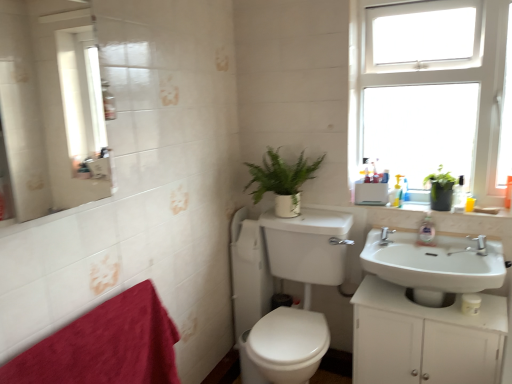
What do you see at coordinates (426, 231) in the screenshot?
I see `clear plastic soap dispenser at sink right` at bounding box center [426, 231].

Image resolution: width=512 pixels, height=384 pixels. I want to click on yellow plastic bottle at upper right, placed as the second toiletry when sorted from back to front, so click(469, 204).

This screenshot has width=512, height=384. Find the location of `white plastic window at upper right`. white plastic window at upper right is located at coordinates (438, 74).

Measure the distance between point (393, 192) and camera.

The depth of point (393, 192) is 2.13 meters.

In order to click on metallic reflective mirror at upper left in this screenshot , I will do click(51, 106).

From a real-world perspective, is yellow plastic bottle at upper right, placed as the second toiletry when sorted from back to front, positioned above or below white glossy sink at upper right?

yellow plastic bottle at upper right, placed as the second toiletry when sorted from back to front, is above white glossy sink at upper right.

Which of these two, yellow plastic bottle at upper right, the second toiletry positioned from the left, or white glossy sink at upper right, is wider?

white glossy sink at upper right.

Measure the distance between yellow plastic bottle at upper right, the second toiletry positioned from the left, and white glossy sink at upper right.

6.50 inches.

Does yellow plastic bottle at upper right, marked as the first toiletry in a front-to-back arrangement, turn towards white glossy sink at upper right?

No.

Are white matte cabinet at lower right and translucent plastic soap dispenser at upper right, which is the second toiletry in right-to-left order, making contact?

No, white matte cabinet at lower right is not touching translucent plastic soap dispenser at upper right, which is the second toiletry in right-to-left order.

Is white matte cabinet at lower right further to the viewer compared to translucent plastic soap dispenser at upper right, which ranks as the second toiletry in front-to-back order?

That is False.

This screenshot has height=384, width=512. Identify the location of toiletry on the left of white matte cabinet at lower right. (396, 193).

Who is smaller, white matte cabinet at lower right or translucent plastic soap dispenser at upper right, which is the second toiletry in right-to-left order?

With smaller size is translucent plastic soap dispenser at upper right, which is the second toiletry in right-to-left order.

From the image's perspective, which one is positioned lower, white plastic window at upper right or green matte plant at upper right?

From the image's view, green matte plant at upper right is below.

Would you say white plastic window at upper right contains green matte plant at upper right?

No, green matte plant at upper right is not surrounded by white plastic window at upper right.

Is white plastic window at upper right behind green matte plant at upper right?

No, white plastic window at upper right is closer to the viewer.

Identify the location of window in front of the green matte plant at upper right. (438, 74).

From a real-world perspective, which object stands above the other?

clear plastic soap dispenser at sink right.

Who is shorter, clear plastic soap dispenser at sink right or white matte toilet paper at lower center?

Standing shorter between the two is white matte toilet paper at lower center.

Considering the sizes of clear plastic soap dispenser at sink right and white matte toilet paper at lower center in the image, is clear plastic soap dispenser at sink right wider or thinner than white matte toilet paper at lower center?

Result: Considering their sizes, clear plastic soap dispenser at sink right looks slimmer than white matte toilet paper at lower center.

Looking at this image, is clear plastic soap dispenser at sink right inside or outside of white matte toilet paper at lower center?

The correct answer is: outside.

From the picture: Considering the relative sizes of translucent plastic soap dispenser at upper right, which is the second toiletry in right-to-left order, and white plastic window at upper right in the image provided, is translucent plastic soap dispenser at upper right, which is the second toiletry in right-to-left order, thinner than white plastic window at upper right?

Yes, translucent plastic soap dispenser at upper right, which is the second toiletry in right-to-left order, is thinner than white plastic window at upper right.

Looking at this image, from the image's perspective, is translucent plastic soap dispenser at upper right, which is the second toiletry in right-to-left order, located above white plastic window at upper right?

Actually, translucent plastic soap dispenser at upper right, which is the second toiletry in right-to-left order, appears below white plastic window at upper right in the image.

Considering the positions of objects translucent plastic soap dispenser at upper right, placed as the 1th toiletry when sorted from left to right, and white plastic window at upper right in the image provided, who is more to the left, translucent plastic soap dispenser at upper right, placed as the 1th toiletry when sorted from left to right, or white plastic window at upper right?

translucent plastic soap dispenser at upper right, placed as the 1th toiletry when sorted from left to right.

Considering the positions of point (394, 187) and point (354, 142), is point (394, 187) closer or farther from the camera than point (354, 142)?

Point (394, 187).

Are white glossy sink at upper right and white matte toilet paper at lower center located far from each other?

No, white glossy sink at upper right is not far from white matte toilet paper at lower center.

From the image's perspective, is white glossy sink at upper right beneath white matte toilet paper at lower center?

Incorrect, from the image's perspective, white glossy sink at upper right is higher than white matte toilet paper at lower center.

From a real-world perspective, is white glossy sink at upper right beneath white matte toilet paper at lower center?

No, from a real-world perspective, white glossy sink at upper right is not under white matte toilet paper at lower center.

What's the angular difference between white glossy sink at upper right and white matte toilet paper at lower center's facing directions?

There is a 0.235-degree angle between the facing directions of white glossy sink at upper right and white matte toilet paper at lower center.

Is green matte plant at center in front of white glossy sink at lower right, the second sink when ordered from left to right?

That is False.

Is green matte plant at center oriented towards white glossy sink at lower right, marked as the 1th sink in a right-to-left arrangement?

No, green matte plant at center is not aimed at white glossy sink at lower right, marked as the 1th sink in a right-to-left arrangement.

From a real-world perspective, which object stands above the other?

green matte plant at center, from a real-world perspective.

Which toiletry is the 1st one when counting from the back of the white glossy sink at upper right? Please provide its 2D coordinates.

[(469, 204)]

Locate an element on the screen. The image size is (512, 384). toiletry on the left of white matte cabinet at lower right is located at coordinates (396, 193).

When comparing their distances from metallic reflective mirror at upper left, does white glossy sink at lower right, marked as the 1th sink in a right-to-left arrangement, or white matte cabinet at lower right seem further?

The object further to metallic reflective mirror at upper left is white matte cabinet at lower right.

From the image, which object appears to be nearer to velvety red bath towel at lower left, yellow plastic bottle at upper right, marked as the first toiletry in a front-to-back arrangement, or translucent plastic soap dispenser at upper right, which ranks as the second toiletry in front-to-back order?

translucent plastic soap dispenser at upper right, which ranks as the second toiletry in front-to-back order.

When comparing their distances from velvety red bath towel at lower left, does white glossy sink at lower right, marked as the 1th sink in a right-to-left arrangement, or yellow plastic bottle at upper right, marked as the first toiletry in a front-to-back arrangement, seem closer?

white glossy sink at lower right, marked as the 1th sink in a right-to-left arrangement, is closer to velvety red bath towel at lower left.

From the image, which object appears to be nearer to green matte plant at upper right, white glossy sink at upper right or white matte toilet paper at lower center?

white glossy sink at upper right lies closer to green matte plant at upper right than the other object.

Considering their positions, is velvety red bath towel at lower left positioned further to white matte toilet paper at lower center than translucent plastic soap dispenser at upper right, placed as the 1th toiletry when sorted from left to right?

velvety red bath towel at lower left.

Considering their positions, is metallic reflective mirror at upper left positioned further to green matte plant at upper right than white glossy sink at lower right, the second sink when ordered from left to right?

metallic reflective mirror at upper left lies further to green matte plant at upper right than the other object.

From the image, which object appears to be nearer to green matte plant at center, white plastic window at upper right or yellow plastic bottle at upper right, which is the 1th toiletry from right to left?

white plastic window at upper right is closer to green matte plant at center.

When comparing their distances from white glossy sink at center, which appears as the second sink when viewed from the right, does metallic reflective mirror at upper left or white matte toilet paper at lower center seem further?

Among the two, metallic reflective mirror at upper left is located further to white glossy sink at center, which appears as the second sink when viewed from the right.

Image resolution: width=512 pixels, height=384 pixels. Identify the location of tap between metallic reflective mirror at upper left and white glossy sink at lower right, marked as the 1th sink in a right-to-left arrangement. (385, 236).

Locate an element on the screen. Image resolution: width=512 pixels, height=384 pixels. plant between white glossy sink at upper right and yellow plastic bottle at upper right, the second toiletry positioned from the left is located at coordinates (440, 177).

Identify the location of sink between white glossy sink at center, arranged as the 1th sink when viewed from the left, and white matte toilet paper at lower center. The width and height of the screenshot is (512, 384). (434, 265).

Locate an element on the screen. The height and width of the screenshot is (384, 512). toiletry situated between white glossy sink at center, which appears as the second sink when viewed from the right, and white matte toilet paper at lower center from left to right is located at coordinates (396, 193).